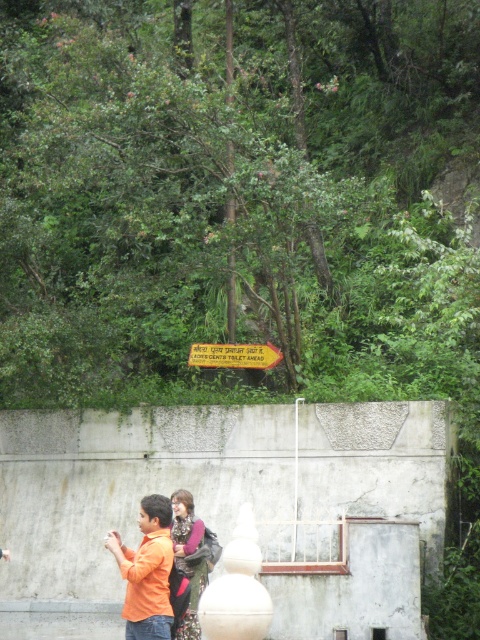
You are standing at the base of the concrete wall and want to take a photo of the matte pink sweater at center. Your camera is 43.79 feet away from the sweater. Can you capture the entire sweater in one shot without moving the camera?

The matte pink sweater at center and camera are 43.79 feet apart from each other. Since the camera is positioned at this distance, you may need to adjust your lens or move closer to ensure the entire sweater fits within the frame, as 43.79 feet might be too far for a standard lens to capture the detail required.

You are a hiker who just arrived at a trailhead and see the orange matte shirt at lower left and the metallic yellow arrow at center. Which object is taller?

The orange matte shirt at lower left is much taller than the metallic yellow arrow at center.